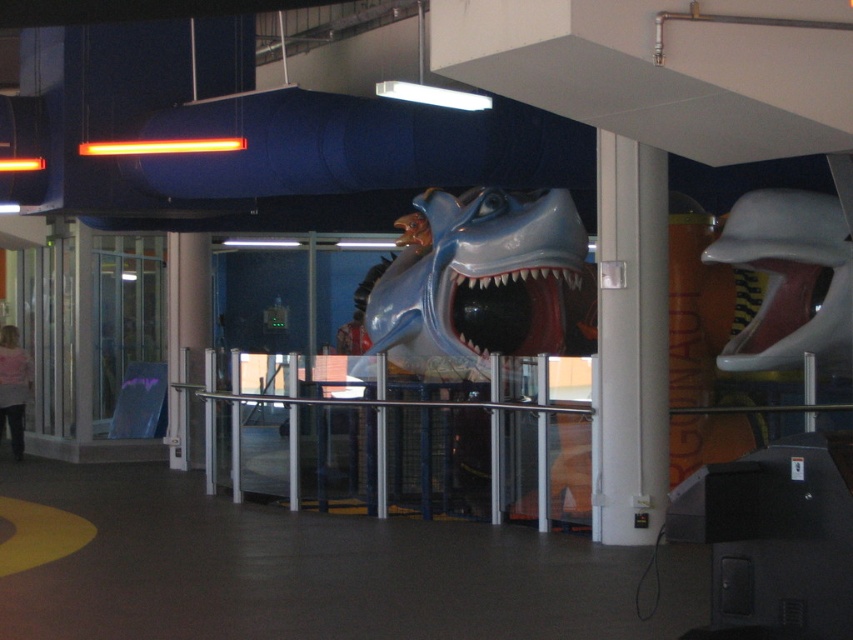
You are a visitor in the museum and want to take a photo of the shiny blue plastic shark at center and the white glossy pillar at center. Which object should you focus on first if you want to capture both in a single frame without moving your camera?

The shiny blue plastic shark at center is larger in size compared to the white glossy pillar at center, so you should focus on the shiny blue plastic shark at center first to ensure it fits properly in the frame before adjusting for the smaller pillar.

You are a visitor at the museum and want to take a photo of the shiny blue plastic shark at center and the shiny blue mouth at center. Which object should you zoom in on to capture both in the frame without moving the camera?

You should zoom in on the shiny blue mouth at center because it is smaller than the shiny blue plastic shark at center, allowing both to fit within the frame when zoomed in appropriately.